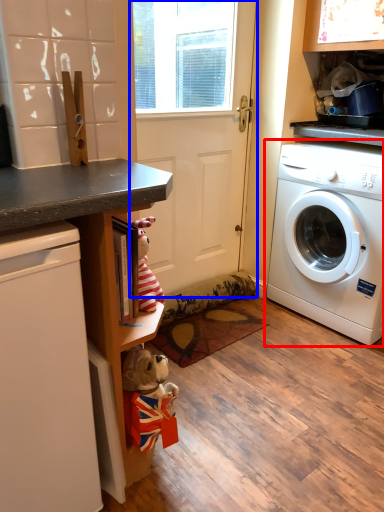
Question: Which point is closer to the camera, washing machine (highlighted by a red box) or screen door (highlighted by a blue box)?

Choices:
 (A) washing machine
 (B) screen door

Answer: (A)